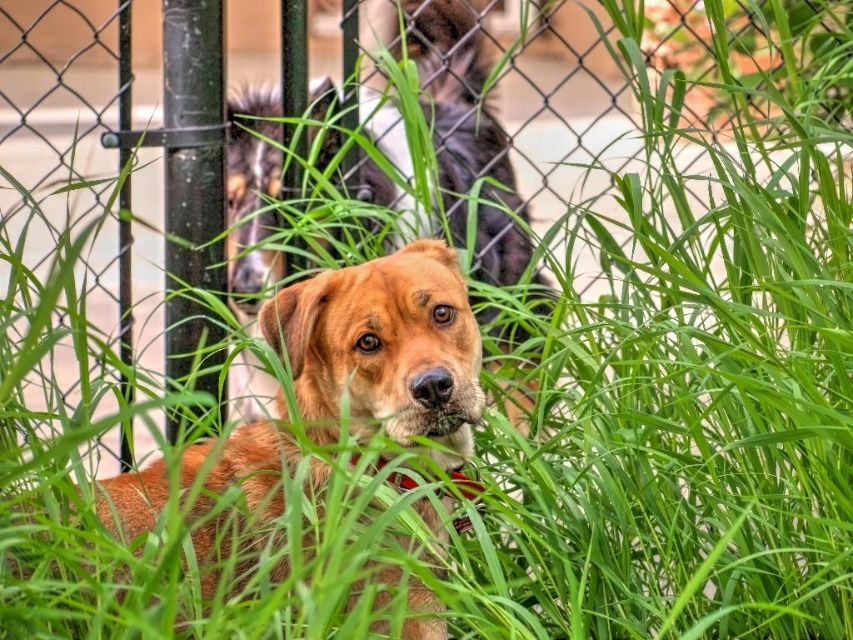
Is golden fur dog at center thinner than red fabric collar at center?

Incorrect, golden fur dog at center's width is not less than red fabric collar at center's.

Describe the element at coordinates (383, 349) in the screenshot. I see `golden fur dog at center` at that location.

Locate an element on the screen. golden fur dog at center is located at coordinates [x=383, y=349].

Does golden fur dog at center appear on the right side of golden brown fur at center?

No, golden fur dog at center is not to the right of golden brown fur at center.

Between point (270, 484) and point (236, 243), which one is positioned in front?

Positioned in front is point (270, 484).

Identify the location of golden fur dog at center. This screenshot has height=640, width=853. (383, 349).

In the scene shown: Is golden brown fur at center below red fabric collar at center?

Incorrect, golden brown fur at center is not positioned below red fabric collar at center.

Locate an element on the screen. This screenshot has height=640, width=853. golden brown fur at center is located at coordinates (462, 129).

Between point (444, 124) and point (463, 493), which one is positioned in front?

Point (463, 493) is in front.

This screenshot has width=853, height=640. I want to click on golden brown fur at center, so click(462, 129).